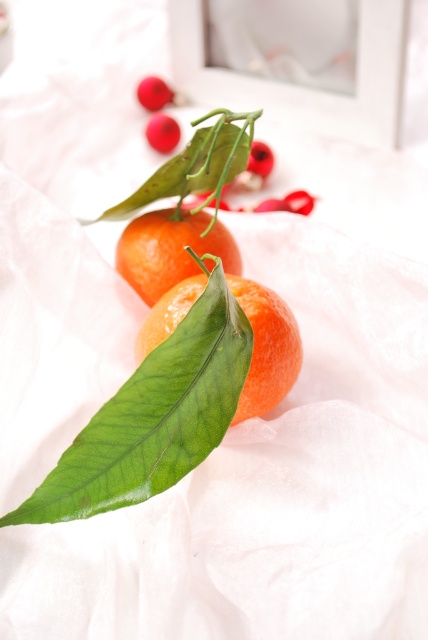
How distant is green glossy leaf at center from glossy orange at center?

green glossy leaf at center is 6.41 inches away from glossy orange at center.

Between green glossy leaf at center and glossy orange at center, which one appears on the right side from the viewer's perspective?

From the viewer's perspective, glossy orange at center appears more on the right side.

Who is more distant from viewer, (128, 388) or (160, 317)?

Point (160, 317)

This screenshot has width=428, height=640. In order to click on green glossy leaf at center in this screenshot , I will do `click(154, 417)`.

Does glossy orange at center have a greater height compared to orange matte/crushed at center?

Correct, glossy orange at center is much taller as orange matte/crushed at center.

Who is lower down, glossy orange at center or orange matte/crushed at center?

Positioned lower is glossy orange at center.

Is point (262, 300) in front of point (225, 241)?

That is True.

Where is `glossy orange at center`? glossy orange at center is located at coordinates (265, 348).

Which of these two, green glossy leaf at center or orange matte/crushed at center, stands taller?

green glossy leaf at center

Who is lower down, green glossy leaf at center or orange matte/crushed at center?

green glossy leaf at center

The image size is (428, 640). Find the location of `green glossy leaf at center`. green glossy leaf at center is located at coordinates (154, 417).